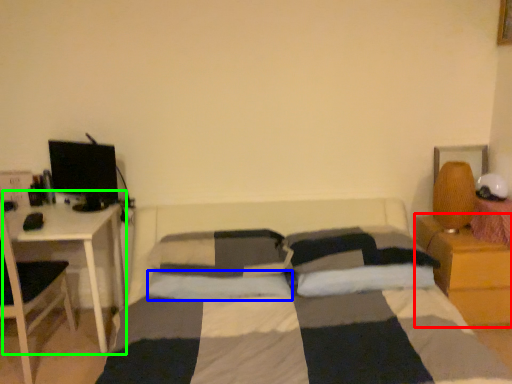
Question: Which object is positioned farthest from nightstand (highlighted by a red box)? Select from pillow (highlighted by a blue box) and table (highlighted by a green box).

Choices:
 (A) pillow
 (B) table

Answer: (B)